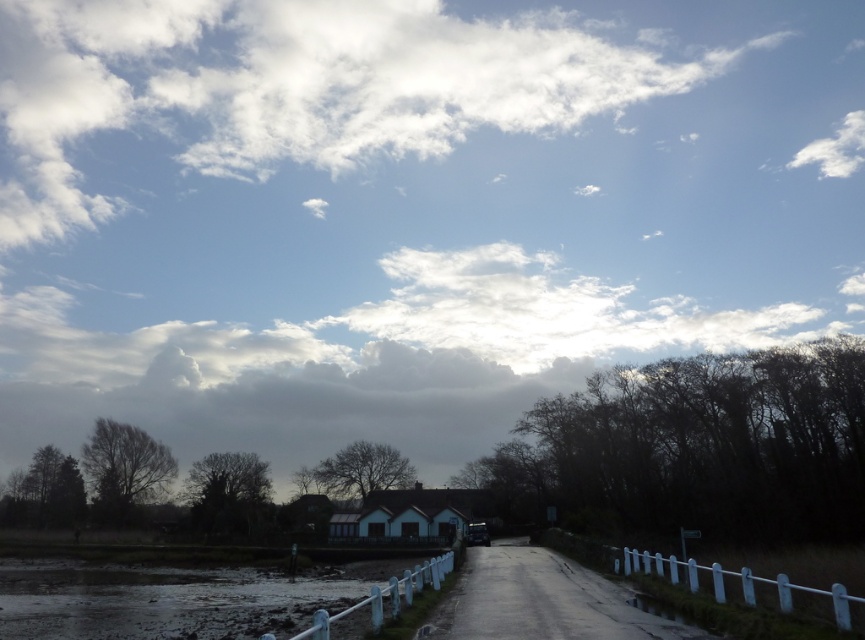
Question: Which of these objects is positioned farthest from the muddy wet ground at lower left?

Choices:
 (A) white plastic fence at lower center
 (B) white fluffy cloud at upper center

Answer: (B)

Question: Which object is positioned closest to the white plastic fence at lower center?

Choices:
 (A) muddy wet ground at lower left
 (B) white fluffy cloud at upper center
 (C) white plastic fence at lower right

Answer: (C)

Question: Where is white fluffy cloud at upper center located in relation to white plastic fence at lower right in the image?

Choices:
 (A) right
 (B) left

Answer: (B)

Question: Does white plastic fence at lower right have a larger size compared to white plastic fence at lower center?

Choices:
 (A) no
 (B) yes

Answer: (A)

Question: Which of the following is the farthest from the observer?

Choices:
 (A) white plastic fence at lower right
 (B) muddy wet ground at lower left
 (C) white plastic fence at lower center
 (D) white fluffy cloud at upper center

Answer: (D)

Question: Can you confirm if muddy wet ground at lower left is wider than white plastic fence at lower right?

Choices:
 (A) no
 (B) yes

Answer: (B)